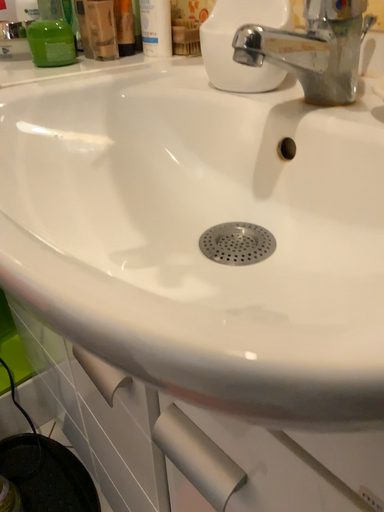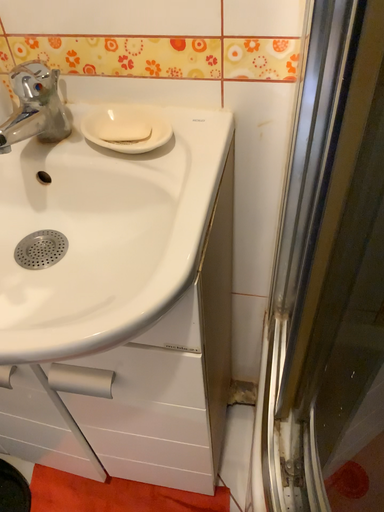
Question: How did the camera likely rotate when shooting the video?

Choices:
 (A) rotated left
 (B) rotated right

Answer: (B)